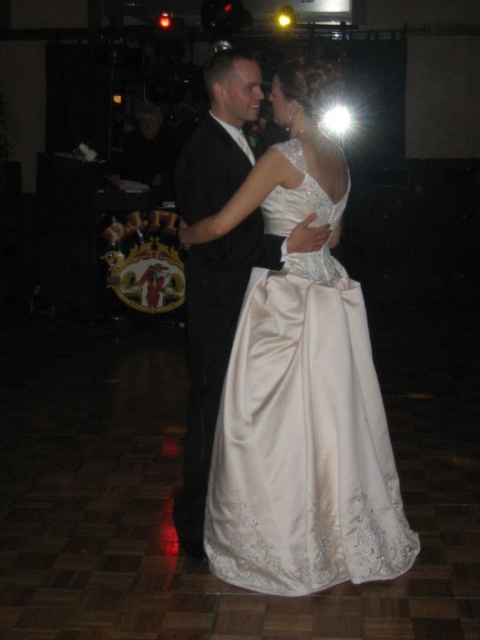
Is point (268, 216) positioned in front of point (248, 160)?

That is True.

Which is below, satin/embroidered dress at center or black satin suit at center?

satin/embroidered dress at center

Is point (254, 371) farther from camera compared to point (256, 228)?

No.

You are a GUI agent. You are given a task and a screenshot of the screen. Output one action in this format:
    pyautogui.click(x=<x>, y=<y>)
    Task: Click on the satin/embroidered dress at center
    
    Given the screenshot: What is the action you would take?
    pyautogui.click(x=303, y=442)